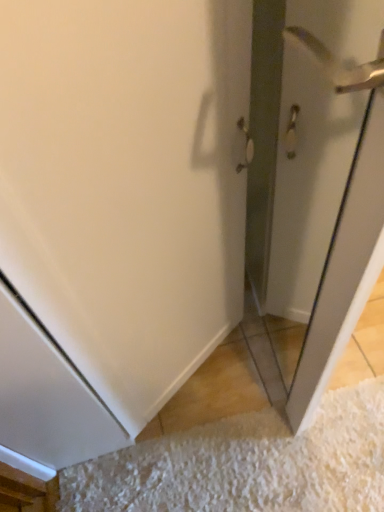
The image size is (384, 512). What do you see at coordinates (314, 179) in the screenshot?
I see `clear glass screen door at right` at bounding box center [314, 179].

Where is `polished silver door handle at upper right`? The width and height of the screenshot is (384, 512). polished silver door handle at upper right is located at coordinates (340, 64).

Is clear glass screen door at right surrounded by white textured doormat at lower right?

No.

Is white textured doormat at lower right positioned far away from clear glass screen door at right?

Actually, white textured doormat at lower right and clear glass screen door at right are a little close together.

Is white textured doormat at lower right oriented towards clear glass screen door at right?

No, white textured doormat at lower right is not aimed at clear glass screen door at right.

Which object is positioned more to the left, polished silver door handle at upper right or white textured doormat at lower right?

From the viewer's perspective, white textured doormat at lower right appears more on the left side.

Can you tell me how much polished silver door handle at upper right and white textured doormat at lower right differ in facing direction?

polished silver door handle at upper right and white textured doormat at lower right are facing 1.76 degrees away from each other.

From a real-world perspective, is polished silver door handle at upper right positioned under white textured doormat at lower right based on gravity?

No, from a real-world perspective, polished silver door handle at upper right is not under white textured doormat at lower right.

Would you consider clear glass screen door at right to be distant from polished silver door handle at upper right?

No, clear glass screen door at right is in close proximity to polished silver door handle at upper right.

Considering the sizes of objects clear glass screen door at right and polished silver door handle at upper right in the image provided, who is taller, clear glass screen door at right or polished silver door handle at upper right?

Standing taller between the two is clear glass screen door at right.

Is clear glass screen door at right positioned beyond the bounds of polished silver door handle at upper right?

clear glass screen door at right lies outside polished silver door handle at upper right's area.

Looking at their sizes, would you say clear glass screen door at right is wider or thinner than polished silver door handle at upper right?

Clearly, clear glass screen door at right has less width compared to polished silver door handle at upper right.

Considering the sizes of objects polished silver door handle at upper right and clear glass screen door at right in the image provided, who is bigger, polished silver door handle at upper right or clear glass screen door at right?

Bigger between the two is clear glass screen door at right.

From a real-world perspective, does polished silver door handle at upper right sit lower than clear glass screen door at right?

Yes, from a real-world perspective, polished silver door handle at upper right is under clear glass screen door at right.

From the image's perspective, between polished silver door handle at upper right and clear glass screen door at right, which one is located above?

polished silver door handle at upper right appears higher in the image.

From a real-world perspective, is white textured doormat at lower right above or below polished silver door handle at upper right?

white textured doormat at lower right is situated lower than polished silver door handle at upper right in the real world.

Can you see white textured doormat at lower right touching polished silver door handle at upper right?

No, white textured doormat at lower right is not making contact with polished silver door handle at upper right.

How distant is white textured doormat at lower right from polished silver door handle at upper right?

white textured doormat at lower right is 1.02 meters away from polished silver door handle at upper right.

Can you confirm if white textured doormat at lower right is wider than polished silver door handle at upper right?

Incorrect, the width of white textured doormat at lower right does not surpass that of polished silver door handle at upper right.

From a real-world perspective, which object stands above the other?

From a 3D spatial view, clear glass screen door at right is above.

Can you confirm if clear glass screen door at right is smaller than white textured doormat at lower right?

No, clear glass screen door at right is not smaller than white textured doormat at lower right.

Considering the positions of objects clear glass screen door at right and white textured doormat at lower right in the image provided, who is more to the right, clear glass screen door at right or white textured doormat at lower right?

clear glass screen door at right is more to the right.

The height and width of the screenshot is (512, 384). What are the coordinates of `doormat below the clear glass screen door at right (from the image's perspective)` in the screenshot? It's located at (246, 465).

What are the coordinates of `doormat that is in front of the polished silver door handle at upper right` in the screenshot? It's located at (246, 465).

Which object lies nearer to the anchor point clear glass screen door at right, polished silver door handle at upper right or white textured doormat at lower right?

polished silver door handle at upper right is positioned closer to the anchor clear glass screen door at right.

Looking at the image, which one is located further to white textured doormat at lower right, polished silver door handle at upper right or clear glass screen door at right?

polished silver door handle at upper right is positioned further to the anchor white textured doormat at lower right.

Which object lies further to the anchor point white textured doormat at lower right, clear glass screen door at right or polished silver door handle at upper right?

polished silver door handle at upper right.

Looking at the image, which one is located further to polished silver door handle at upper right, white textured doormat at lower right or clear glass screen door at right?

white textured doormat at lower right is positioned further to the anchor polished silver door handle at upper right.

Consider the image. When comparing their distances from clear glass screen door at right, does white textured doormat at lower right or polished silver door handle at upper right seem further?

white textured doormat at lower right lies further to clear glass screen door at right than the other object.

When comparing their distances from polished silver door handle at upper right, does clear glass screen door at right or white textured doormat at lower right seem closer?

clear glass screen door at right lies closer to polished silver door handle at upper right than the other object.

The height and width of the screenshot is (512, 384). I want to click on screen door that lies between polished silver door handle at upper right and white textured doormat at lower right from top to bottom, so click(314, 179).